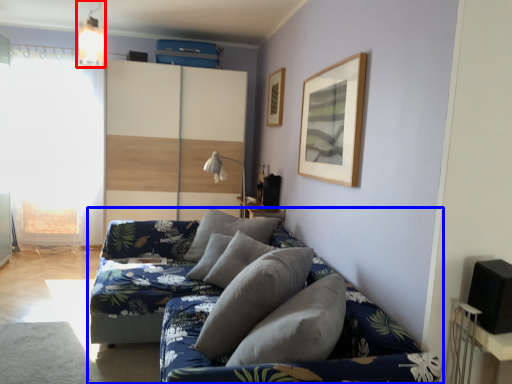
Question: Which point is further to the camera, light fixture (highlighted by a red box) or studio couch (highlighted by a blue box)?

Choices:
 (A) light fixture
 (B) studio couch

Answer: (A)